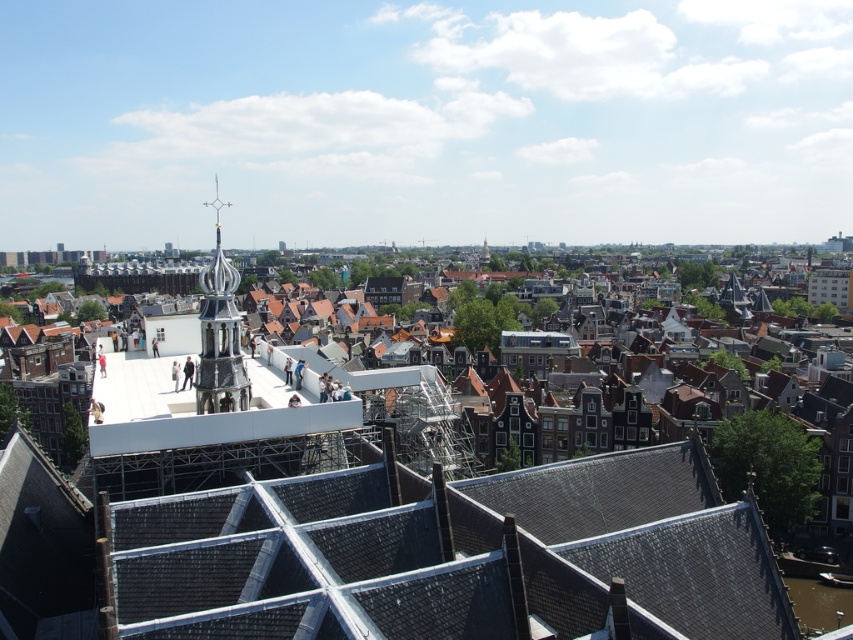
Question: In this image, where is polished silver spire at center-left located relative to polished silver spire at center?

Choices:
 (A) below
 (B) above

Answer: (B)

Question: Is polished silver spire at center-left below polished silver spire at center?

Choices:
 (A) no
 (B) yes

Answer: (A)

Question: Is polished silver spire at center-left wider than polished silver spire at center?

Choices:
 (A) yes
 (B) no

Answer: (A)

Question: Which point is closer to the camera?

Choices:
 (A) (486, 243)
 (B) (218, 330)

Answer: (B)

Question: Which of the following is the closest to the observer?

Choices:
 (A) (224, 353)
 (B) (485, 260)

Answer: (A)